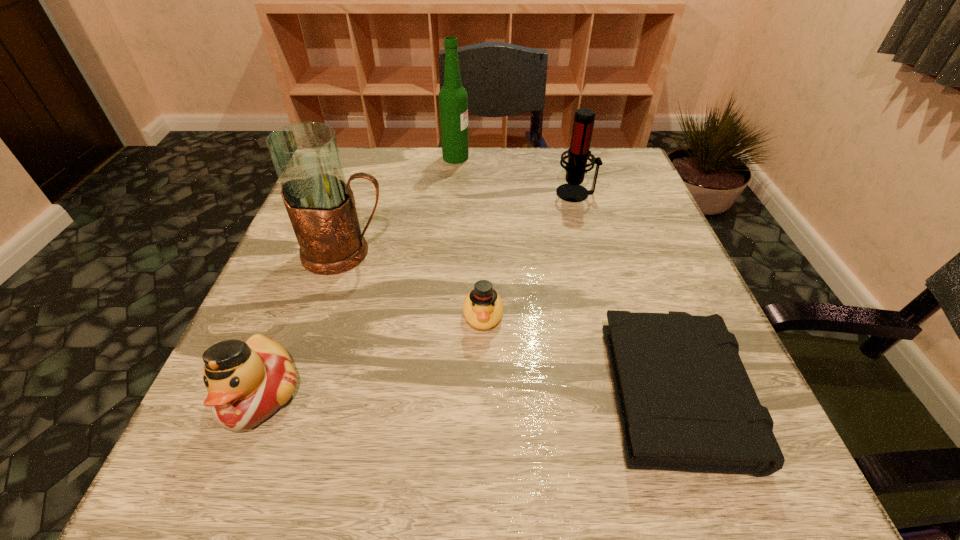
Where is `free space at the near right corner of the desktop`? Image resolution: width=960 pixels, height=540 pixels. free space at the near right corner of the desktop is located at coordinates (750, 478).

Where is `unoccupied position between the left duck and the farthest object`? The height and width of the screenshot is (540, 960). unoccupied position between the left duck and the farthest object is located at coordinates (357, 276).

Find the location of `free space between the fifth shortest object and the taller duck`. free space between the fifth shortest object and the taller duck is located at coordinates (302, 323).

The height and width of the screenshot is (540, 960). In order to click on vacant area that lies between the nearer duck and the shortest object in this screenshot , I will do `click(467, 390)`.

Identify the location of free space between the Bible and the beer bottle. This screenshot has height=540, width=960. (564, 272).

Where is `vacant region between the beer bottle and the fourth nearest object`? The width and height of the screenshot is (960, 540). vacant region between the beer bottle and the fourth nearest object is located at coordinates (400, 205).

Locate an element on the screen. vacant space that's between the farther duck and the pitcher is located at coordinates (415, 284).

This screenshot has height=540, width=960. In order to click on vacant space that is in between the right duck and the shortest object in this screenshot , I will do `click(578, 350)`.

Locate an element on the screen. free space between the farther duck and the beer bottle is located at coordinates (469, 235).

Identify the location of blank region between the microphone and the farthest object. (516, 175).